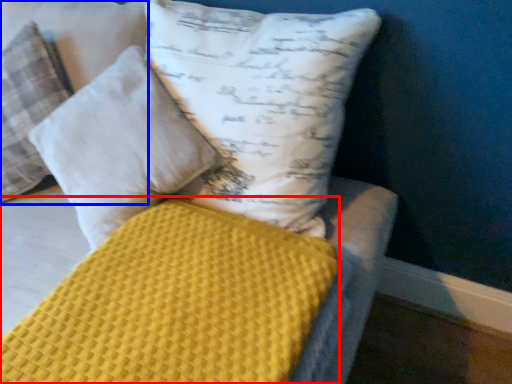
Question: Which point is closer to the camera, mattress (highlighted by a red box) or pillow (highlighted by a blue box)?

Choices:
 (A) mattress
 (B) pillow

Answer: (A)